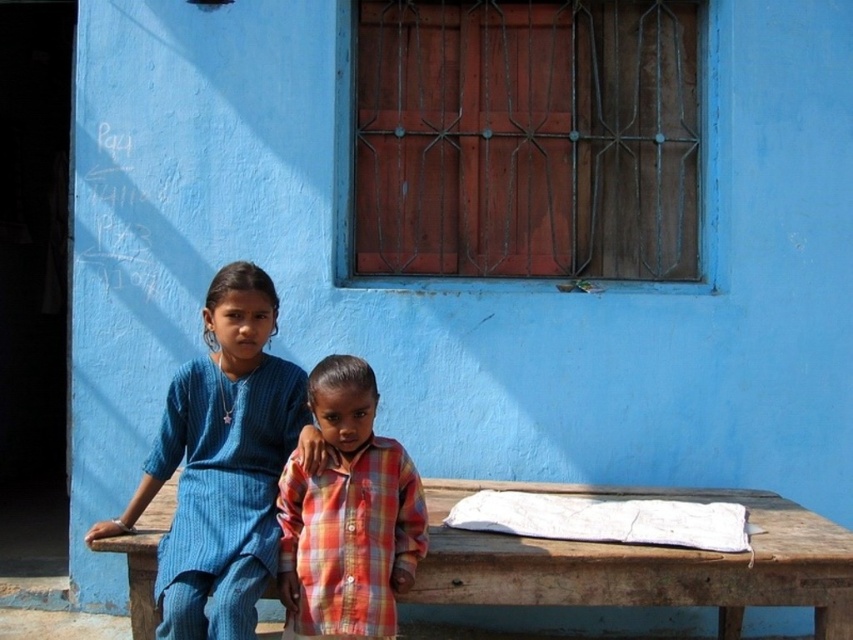
From the picture: Who is positioned more to the left, blue textured dress at center or wooden picnic table at lower center?

From the viewer's perspective, blue textured dress at center appears more on the left side.

Can you confirm if blue textured dress at center is positioned below wooden picnic table at lower center?

No.

Between point (229, 312) and point (575, 582), which one is positioned behind?

The point (229, 312) is behind.

Identify the location of blue textured dress at center. (223, 465).

Is point (234, 611) closer to camera compared to point (346, 488)?

Yes.

Measure the distance between blue textured dress at center and plaid fabric shirt at center.

blue textured dress at center is 8.43 inches away from plaid fabric shirt at center.

Which is behind, point (193, 621) or point (357, 497)?

The point (357, 497) is more distant.

At what (x,y) coordinates should I click in order to perform the action: click on blue textured dress at center. Please return your answer as a coordinate pair (x, y). The width and height of the screenshot is (853, 640). Looking at the image, I should click on (223, 465).

Describe the element at coordinates (643, 561) in the screenshot. The image size is (853, 640). I see `wooden picnic table at lower center` at that location.

Measure the distance between wooden picnic table at lower center and camera.

wooden picnic table at lower center and camera are 3.17 meters apart from each other.

Is point (537, 557) farther from camera compared to point (363, 605)?

Yes.

The image size is (853, 640). What are the coordinates of `wooden picnic table at lower center` in the screenshot? It's located at (643, 561).